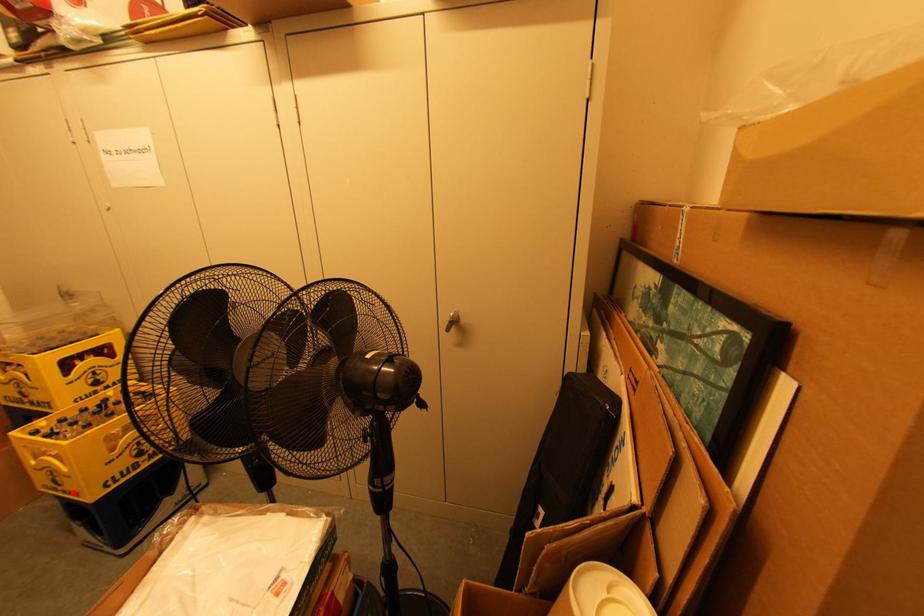
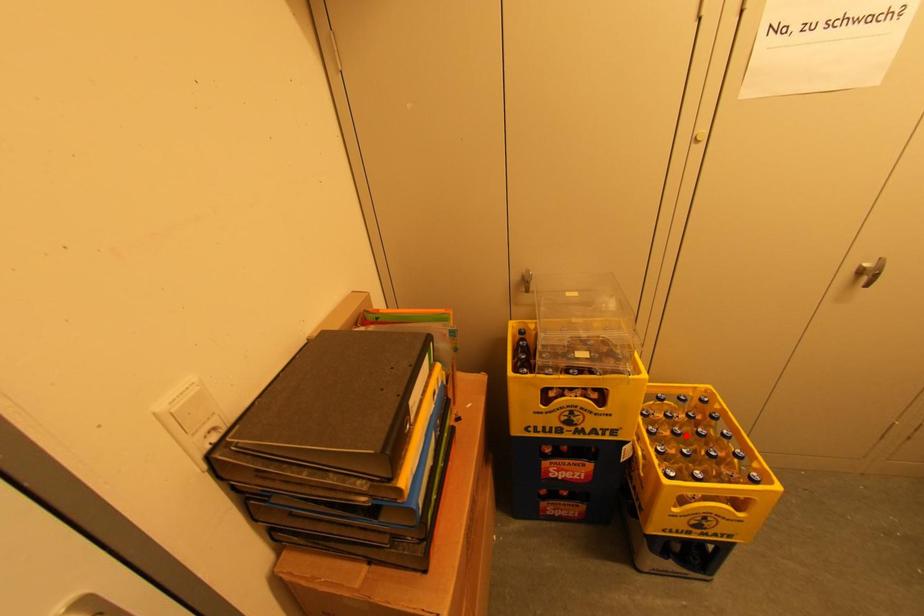
I am providing you with two images of the same scene from different viewpoints. A red point is marked on the first image and another point is marked on the second image. Are the points marked in image1 and image2 representing the same 3D position?

No